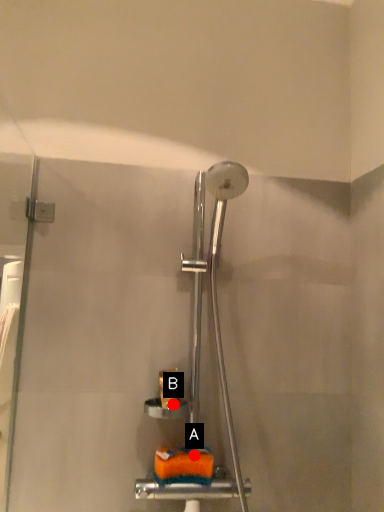
Question: Two points are circled on the image, labeled by A and B beside each circle. Which point is farther to the camera?

Choices:
 (A) A is further
 (B) B is further

Answer: (B)